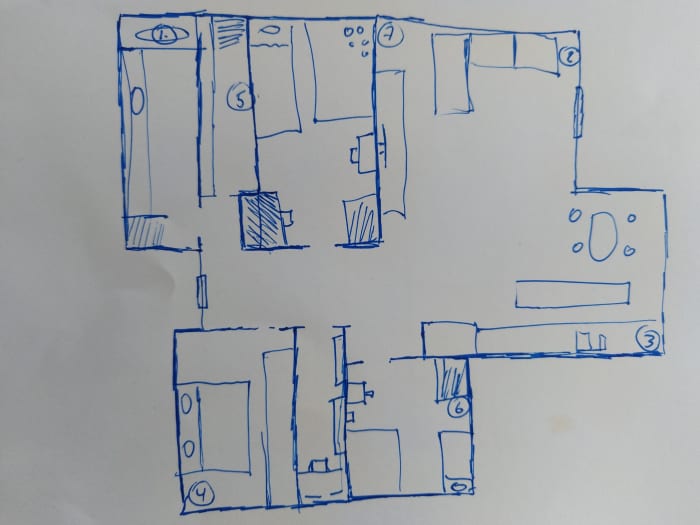
This screenshot has width=700, height=525. Identify the location of doors. (204, 290), (577, 109).